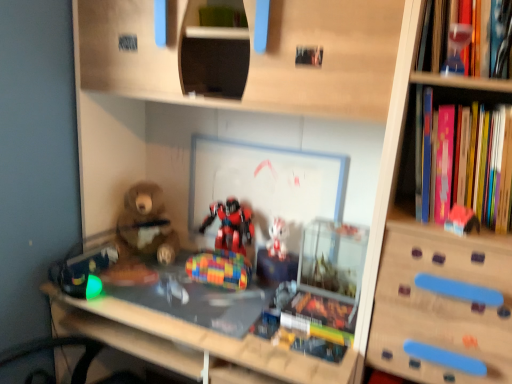
Question: Does wooden bookshelf at right have a larger size compared to pink plastic toy at right, the sixth toy from the left?

Choices:
 (A) yes
 (B) no

Answer: (A)

Question: Considering the relative positions of wooden bookshelf at right and pink plastic toy at right, the sixth toy from the left, in the image provided, is wooden bookshelf at right to the right of pink plastic toy at right, the sixth toy from the left, from the viewer's perspective?

Choices:
 (A) no
 (B) yes

Answer: (B)

Question: Is the position of wooden bookshelf at right less distant than that of pink plastic toy at right, the 5th toy from the back?

Choices:
 (A) yes
 (B) no

Answer: (A)

Question: Is wooden bookshelf at right smaller than pink plastic toy at right, acting as the 2th toy starting from the front?

Choices:
 (A) yes
 (B) no

Answer: (B)

Question: Would you say wooden bookshelf at right is a long distance from pink plastic toy at right, the sixth toy from the left?

Choices:
 (A) no
 (B) yes

Answer: (A)

Question: From a real-world perspective, is wooden bookshelf at right on top of pink plastic toy at right, acting as the 2th toy starting from the front?

Choices:
 (A) yes
 (B) no

Answer: (B)

Question: From a real-world perspective, does hardcover book at center, arranged as the 2th book when viewed from the top, sit lower than transparent glass hourglass at upper right, placed as the sixth toy when sorted from back to front?

Choices:
 (A) yes
 (B) no

Answer: (A)

Question: Is hardcover book at center, marked as the second book in a right-to-left arrangement, to the right of transparent glass hourglass at upper right, acting as the 5th toy starting from the left, from the viewer's perspective?

Choices:
 (A) no
 (B) yes

Answer: (A)

Question: From the image's perspective, is hardcover book at center, placed as the first book when sorted from bottom to top, beneath transparent glass hourglass at upper right, the 1th toy when ordered from front to back?

Choices:
 (A) yes
 (B) no

Answer: (A)

Question: Is there a large distance between hardcover book at center, marked as the second book in a right-to-left arrangement, and transparent glass hourglass at upper right, acting as the 5th toy starting from the left?

Choices:
 (A) no
 (B) yes

Answer: (A)

Question: Could you tell me if hardcover book at center, which is the 1th book in left-to-right order, is facing transparent glass hourglass at upper right, which appears as the 2th toy when viewed from the right?

Choices:
 (A) yes
 (B) no

Answer: (B)

Question: Does hardcover book at center, which is the 1th book in left-to-right order, have a lesser width compared to transparent glass hourglass at upper right, which appears as the 2th toy when viewed from the right?

Choices:
 (A) yes
 (B) no

Answer: (B)

Question: Is hardcover book at center, marked as the second book in a right-to-left arrangement, placed right next to clear glass table at center?

Choices:
 (A) no
 (B) yes

Answer: (A)